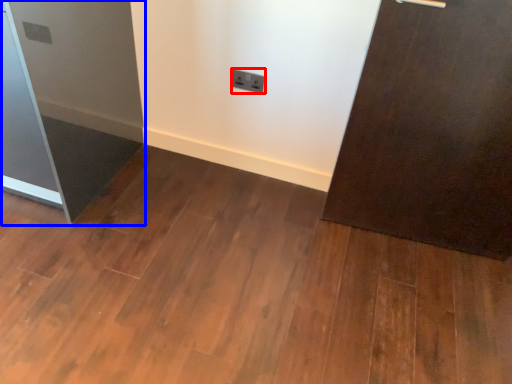
Question: Which of the following is the closest to the observer, electric outlet (highlighted by a red box) or fridge (highlighted by a blue box)?

Choices:
 (A) electric outlet
 (B) fridge

Answer: (B)